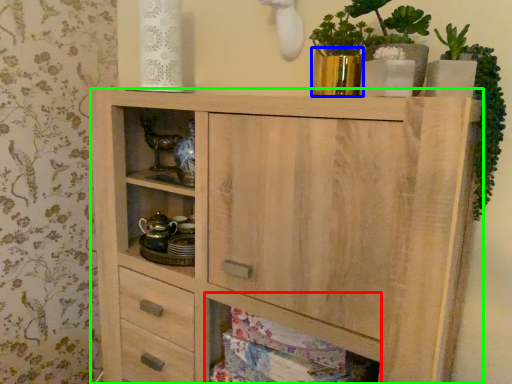
Question: Which object is positioned closest to cabinet (highlighted by a red box)? Select from glass vase (highlighted by a blue box) and chest of drawers (highlighted by a green box).

Choices:
 (A) glass vase
 (B) chest of drawers

Answer: (B)